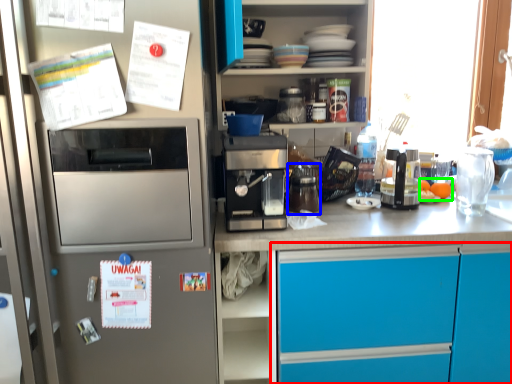
Question: Estimate the real-world distances between objects in this image. Which object is closer to cabinetry (highlighted by a red box), appliance (highlighted by a blue box) or food (highlighted by a green box)?

Choices:
 (A) appliance
 (B) food

Answer: (A)